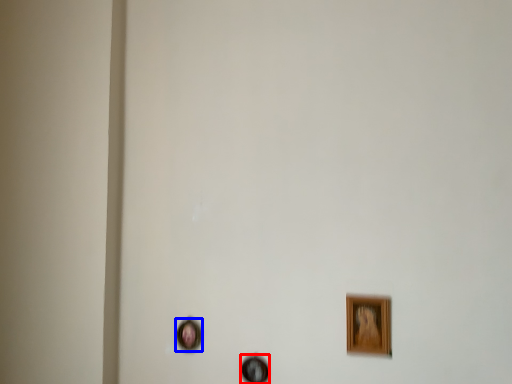
Question: Among these objects, which one is farthest to the camera, picture frame (highlighted by a red box) or picture frame (highlighted by a blue box)?

Choices:
 (A) picture frame
 (B) picture frame

Answer: (B)